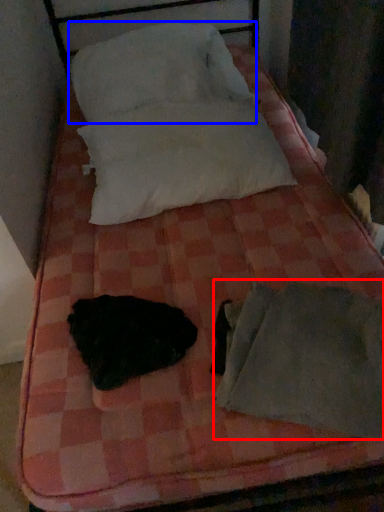
Question: Which object is further to the camera taking this photo, sleeping bag (highlighted by a red box) or pillow (highlighted by a blue box)?

Choices:
 (A) sleeping bag
 (B) pillow

Answer: (B)